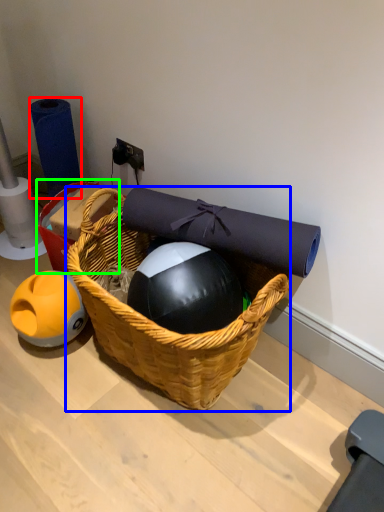
Question: Which object is positioned closest to toilet paper (highlighted by a red box)? Select from picnic basket (highlighted by a blue box) and basket (highlighted by a green box).

Choices:
 (A) picnic basket
 (B) basket

Answer: (B)